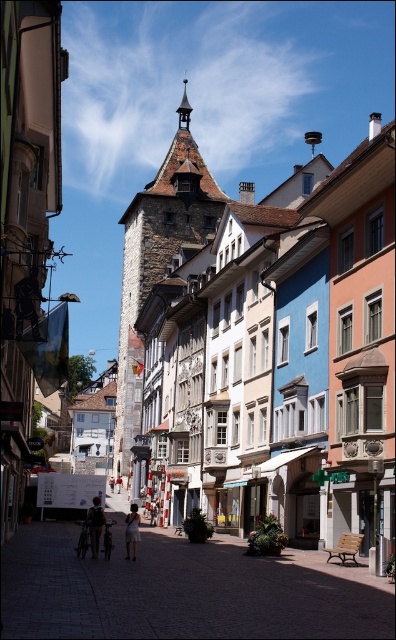
Question: Based on their relative distances, which object is farther from the white cotton dress at center?

Choices:
 (A) stone tower at center
 (B) dark blue jeans at center

Answer: (A)

Question: In this image, where is stone tower at center located relative to dark blue jeans at center?

Choices:
 (A) below
 (B) above

Answer: (B)

Question: Which of these objects is positioned closest to the dark blue jeans at center?

Choices:
 (A) stone tower at center
 (B) white cotton dress at center
 (C) smooth stone pavement at center

Answer: (B)

Question: Is stone tower at center bigger than dark blue jeans at center?

Choices:
 (A) no
 (B) yes

Answer: (B)

Question: Is the position of smooth stone pavement at center less distant than that of white cotton dress at center?

Choices:
 (A) no
 (B) yes

Answer: (B)

Question: Which point appears farthest from the camera in this image?

Choices:
 (A) (135, 541)
 (B) (249, 564)

Answer: (B)